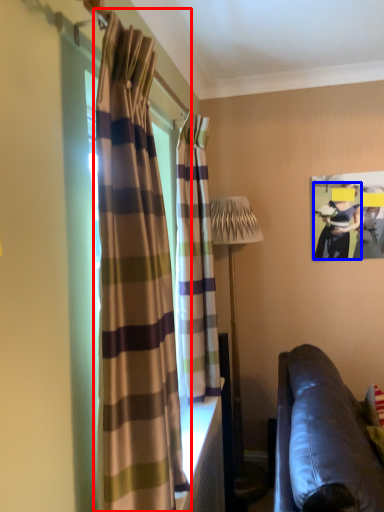
Question: Among these objects, which one is farthest to the camera, curtain (highlighted by a red box) or person (highlighted by a blue box)?

Choices:
 (A) curtain
 (B) person

Answer: (B)